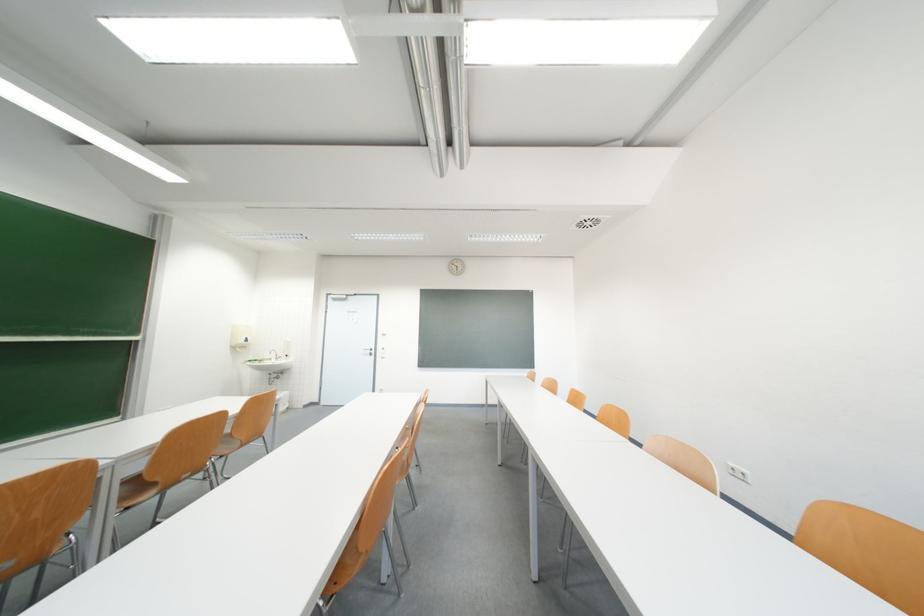
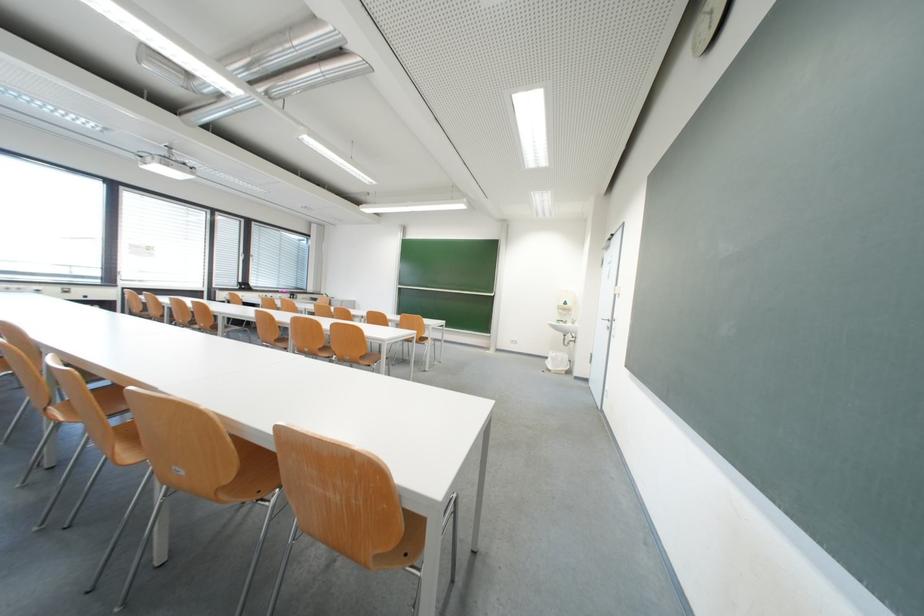
The point at [265,365] is marked in the first image. Where is the corresponding point in the second image?

(570, 326)